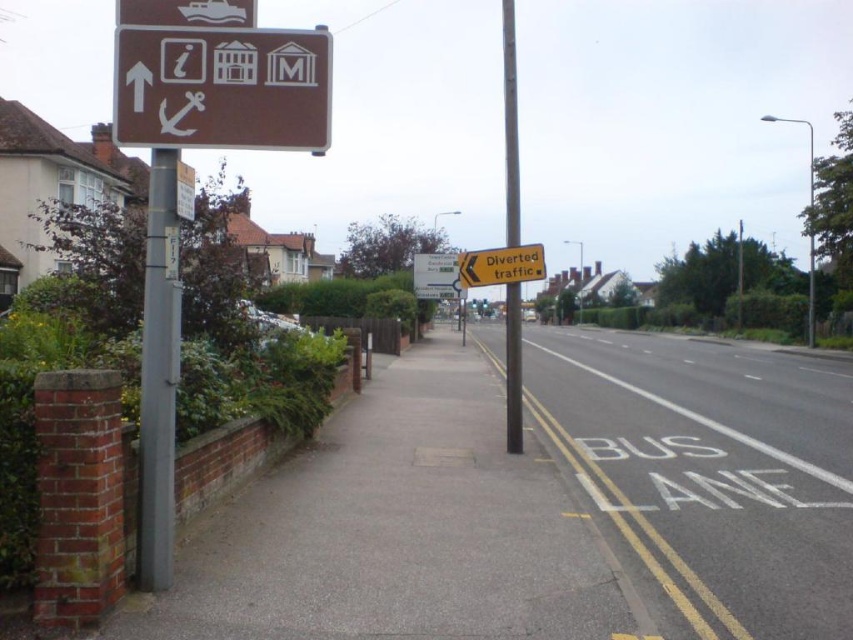
Can you confirm if white painted pavement at lower right is taller than metallic pole at left?

Incorrect, white painted pavement at lower right's height is not larger of metallic pole at left's.

Can you confirm if white painted pavement at lower right is shorter than metallic pole at left?

Yes, white painted pavement at lower right is shorter than metallic pole at left.

This screenshot has height=640, width=853. Describe the element at coordinates (712, 474) in the screenshot. I see `white painted pavement at lower right` at that location.

Find the location of `white painted pavement at lower right`. white painted pavement at lower right is located at coordinates (712, 474).

Which is more to the left, gray concrete sidewalk at left or brown matte sign at upper left?

Positioned to the left is brown matte sign at upper left.

Who is lower down, gray concrete sidewalk at left or brown matte sign at upper left?

gray concrete sidewalk at left is below.

Which is behind, point (221, 636) or point (328, 54)?

Positioned behind is point (328, 54).

Identify the location of gray concrete sidewalk at left. (398, 531).

Between gray concrete sidewalk at left and metallic pole at left, which one is positioned higher?

metallic pole at left is higher up.

Between gray concrete sidewalk at left and metallic pole at left, which one has less height?

Standing shorter between the two is gray concrete sidewalk at left.

Between point (376, 499) and point (172, 392), which one is positioned in front?

Point (172, 392)

At what (x,y) coordinates should I click in order to perform the action: click on gray concrete sidewalk at left. Please return your answer as a coordinate pair (x, y). The image size is (853, 640). Looking at the image, I should click on (398, 531).